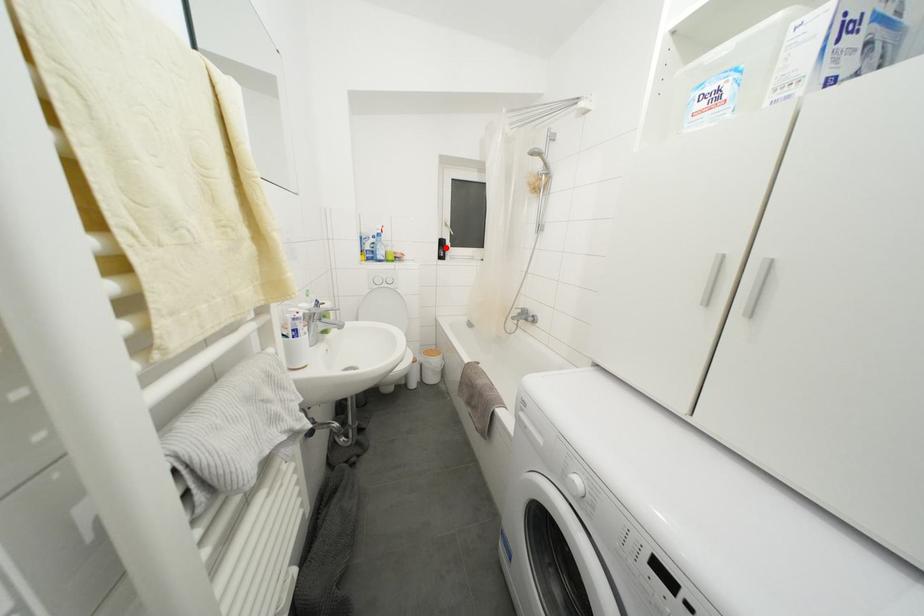
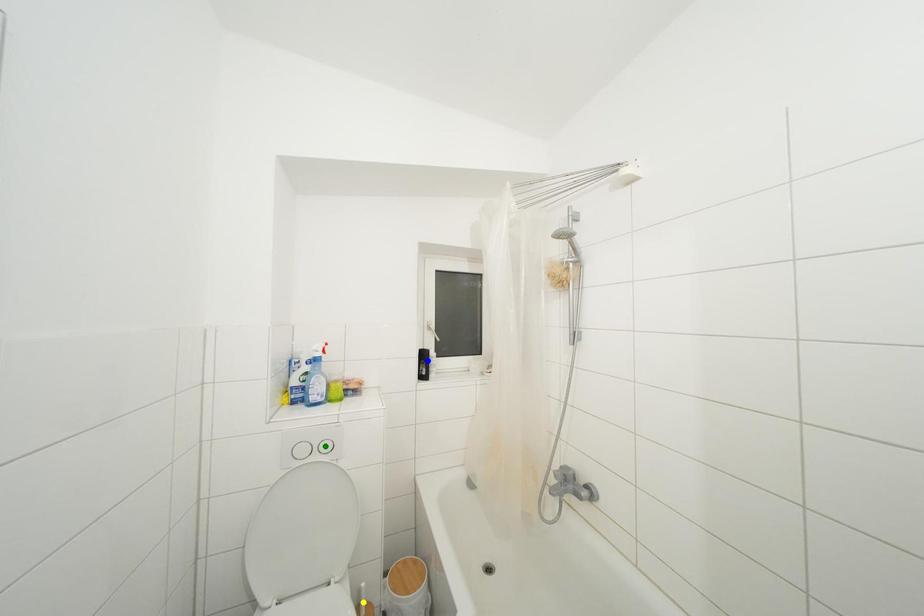
Question: I am providing you with two images of the same scene from different viewpoints. A red point is marked on the first image. You are given multiple points on the second image. Can you choose the point in image 2 that corresponds to the point in image 1?

Choices:
 (A) yellow point
 (B) green point
 (C) blue point

Answer: (C)